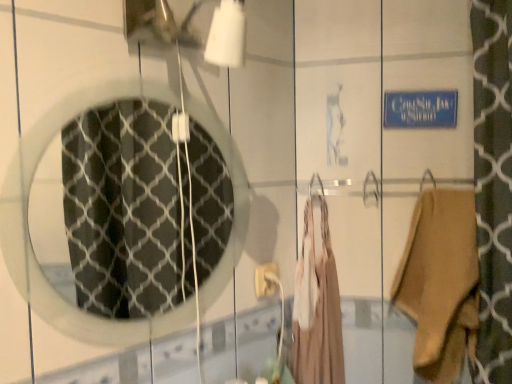
Question: From their relative heights in the image, would you say white plastic electric outlet at center is taller or shorter than clear glass mirror at center?

Choices:
 (A) short
 (B) tall

Answer: (A)

Question: From the image's perspective, is white plastic electric outlet at center above or below clear glass mirror at center?

Choices:
 (A) above
 (B) below

Answer: (B)

Question: Which is farther from the white plastic electric outlet at center?

Choices:
 (A) tan suede boot at right, the 1th clothing viewed from the right
 (B) clear glass mirror at center
 (C) beige fabric dress at center, the 1th clothing when ordered from left to right

Answer: (B)

Question: Estimate the real-world distances between objects in this image. Which object is closer to the white plastic electric outlet at center?

Choices:
 (A) beige fabric dress at center, which is the 2th clothing from right to left
 (B) tan suede boot at right, the 1th clothing viewed from the right
 (C) clear glass mirror at center

Answer: (A)